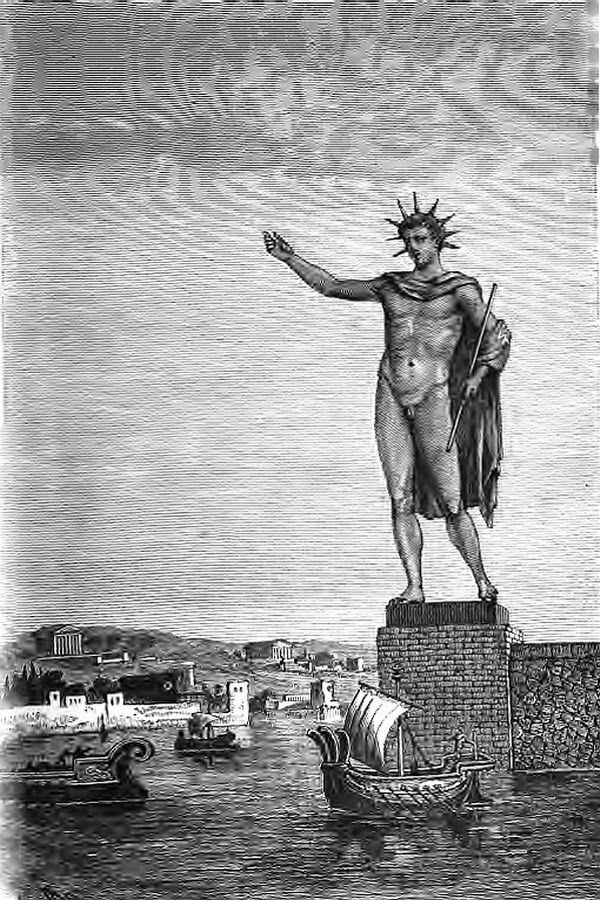
You are a GUI agent. You are given a task and a screenshot of the screen. Output one action in this format:
    pyautogui.click(x=<x>, y=<y>)
    Task: Click on the wall
    This screenshot has height=900, width=600.
    Given the screenshot: What is the action you would take?
    pyautogui.click(x=564, y=707)